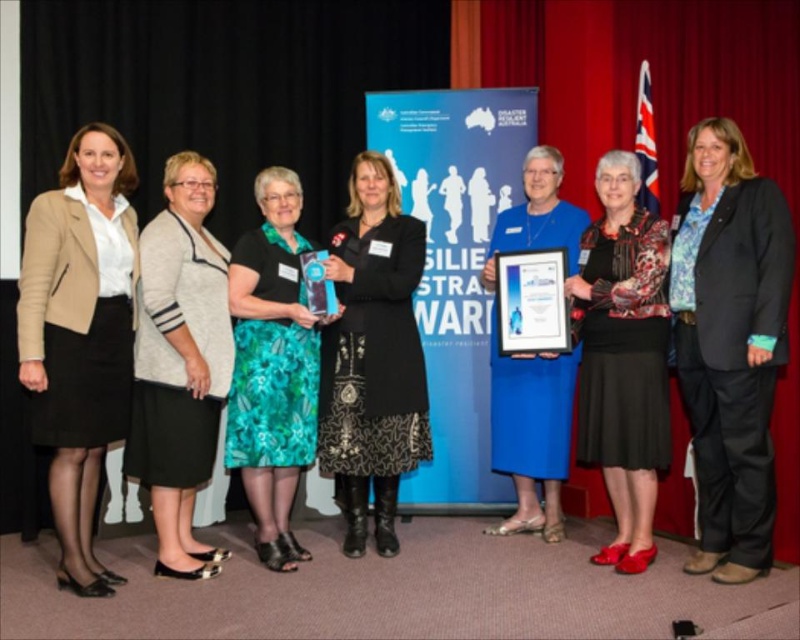
Looking at the two central items, the black textured dress at center and the printed floral blouse at center, which one is positioned to the left?

The black textured dress at center is positioned to the left of the printed floral blouse at center.

You are a photographer at the awards ceremony. You want to take a photo that includes both the black fabric jacket at center and the black textured dress at center. The camera you are using has a minimum focus distance of 1.5 meters. Can you capture both objects in the same frame without moving either of them?

The distance between the black fabric jacket at center and the black textured dress at center is 1.42 meters, which is less than the camera minimum focus distance of 1.5 meters. Therefore, you cannot capture both objects in the same frame without moving them.

You are a photographer at the Disaster Resilience Australia Awards ceremony. You need to position a spotlight exactly at the center of the image to highlight the black textured dress at center. What are the coordinates where you should place the spotlight?

The coordinates for the black textured dress at center are at point (372, 356), so you should place the spotlight at those coordinates to highlight it.